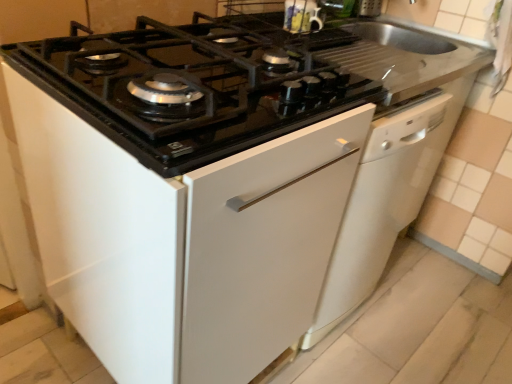
Question: From a real-world perspective, is white glossy dishwasher at center physically located above or below black glass gas stove at upper center?

Choices:
 (A) below
 (B) above

Answer: (A)

Question: Is white glossy dishwasher at center spatially inside black glass gas stove at upper center, or outside of it?

Choices:
 (A) inside
 (B) outside

Answer: (B)

Question: In terms of height, does white glossy dishwasher at center look taller or shorter compared to black glass gas stove at upper center?

Choices:
 (A) short
 (B) tall

Answer: (B)

Question: From their relative heights in the image, would you say black glass gas stove at upper center is taller or shorter than white glossy dishwasher at center?

Choices:
 (A) tall
 (B) short

Answer: (B)

Question: Do you think black glass gas stove at upper center is within white glossy dishwasher at center, or outside of it?

Choices:
 (A) inside
 (B) outside

Answer: (B)

Question: From a real-world perspective, is black glass gas stove at upper center positioned above or below white glossy dishwasher at center?

Choices:
 (A) below
 (B) above

Answer: (B)

Question: Relative to white glossy dishwasher at center, is black glass gas stove at upper center in front or behind?

Choices:
 (A) front
 (B) behind

Answer: (A)